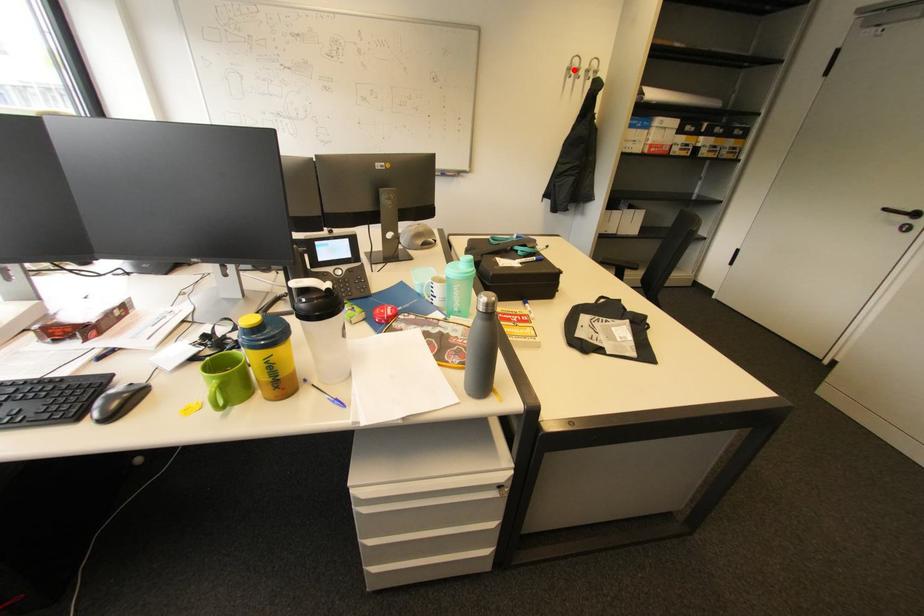
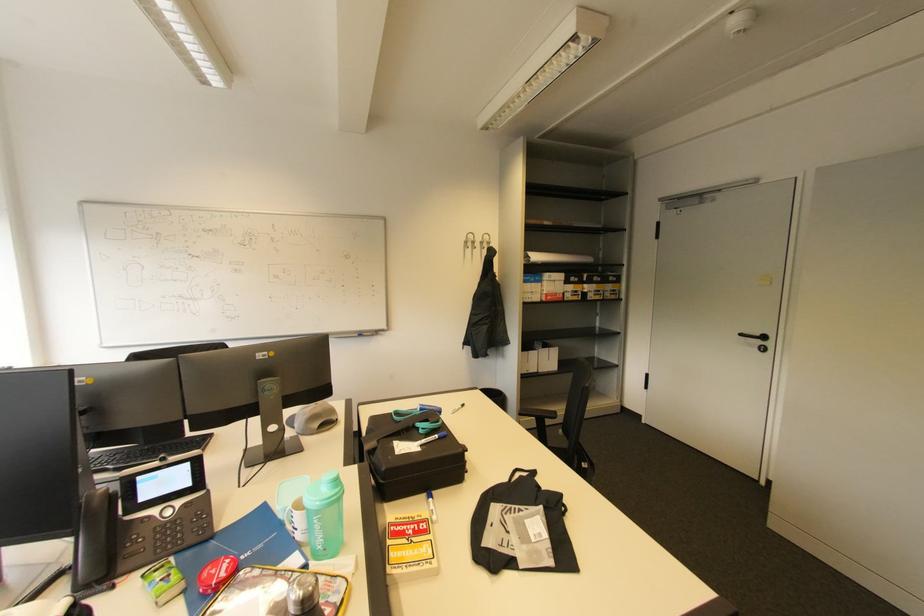
Find the pixel in the second image that matches the highlighted location in the first image.

(470, 243)